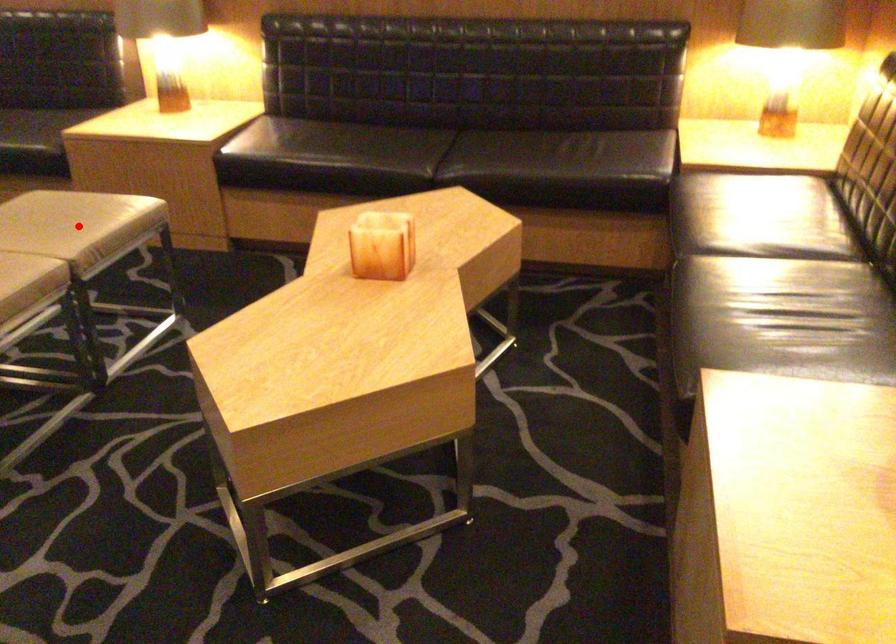
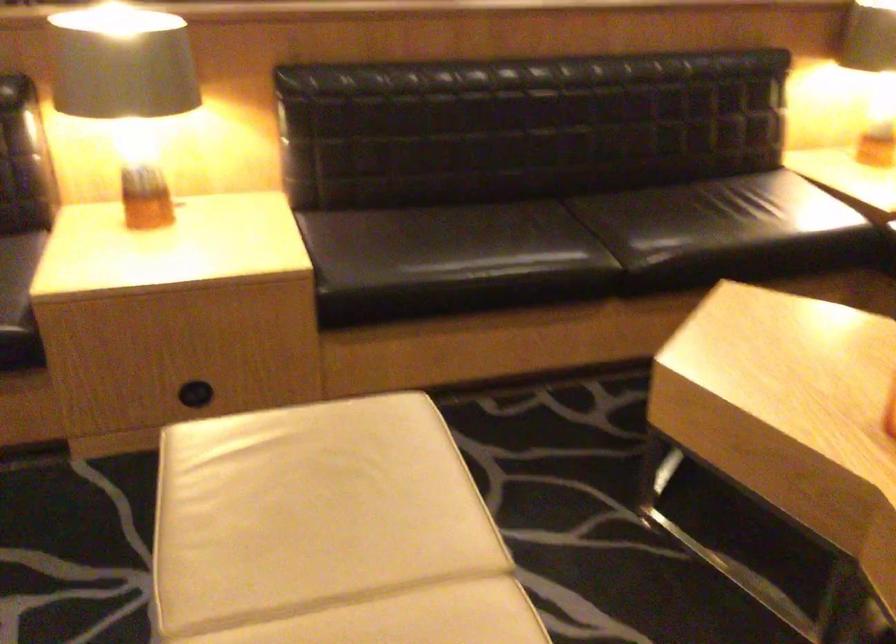
Question: I am providing you with two images of the same scene from different viewpoints. A red point is marked on the first image. At the location where the point appears in image 1, is it still visible in image 2?

Choices:
 (A) Yes
 (B) No

Answer: (B)